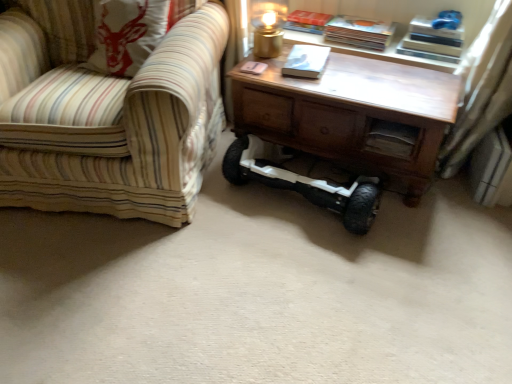
I want to click on free region under white matte hoverboard at center (from a real-world perspective), so click(x=288, y=204).